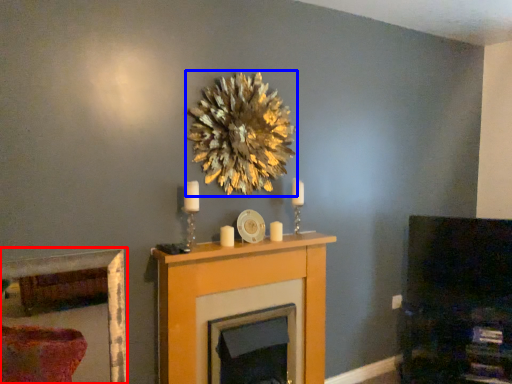
Question: Which object appears closest to the camera in this image, picture frame (highlighted by a red box) or flower (highlighted by a blue box)?

Choices:
 (A) picture frame
 (B) flower

Answer: (A)